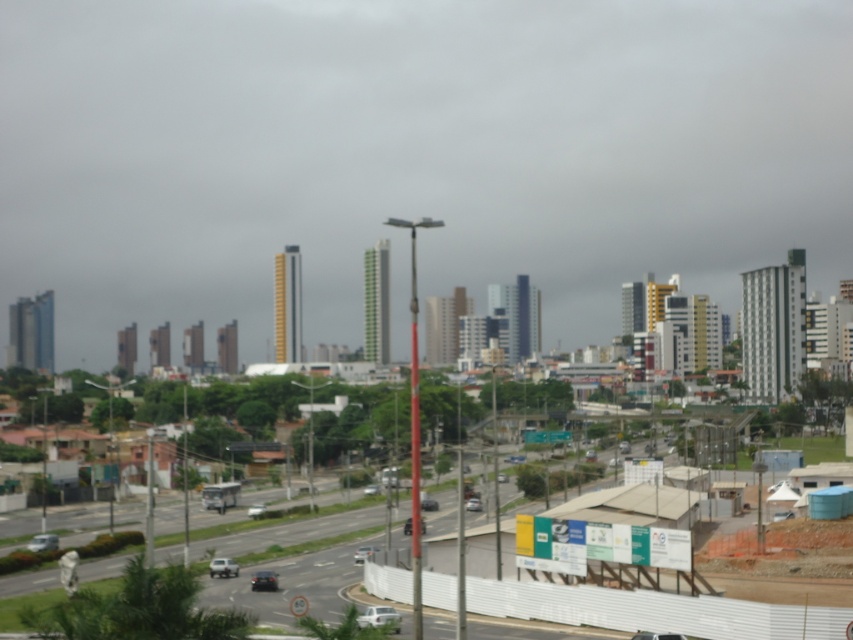
Does matte silver car at lower left appear on the right side of silver metallic car at center?

In fact, matte silver car at lower left is to the left of silver metallic car at center.

Can you confirm if matte silver car at lower left is bigger than silver metallic car at center?

No.

Image resolution: width=853 pixels, height=640 pixels. What do you see at coordinates (223, 566) in the screenshot?
I see `matte silver car at lower left` at bounding box center [223, 566].

Where is `matte silver car at lower left`? The height and width of the screenshot is (640, 853). matte silver car at lower left is located at coordinates (223, 566).

Between point (392, 632) and point (260, 509), which one is positioned behind?

Point (260, 509)

Is point (370, 609) less distant than point (264, 508)?

Yes, it is in front of point (264, 508).

Find the location of `white matte car at lower center`. white matte car at lower center is located at coordinates (380, 618).

Is shiny black car at center smaller than white matte car at center?

Indeed, shiny black car at center has a smaller size compared to white matte car at center.

Between point (265, 586) and point (252, 508), which one is positioned behind?

Point (252, 508)

Describe the element at coordinates (264, 580) in the screenshot. I see `shiny black car at center` at that location.

Locate an element on the screen. The height and width of the screenshot is (640, 853). shiny black car at center is located at coordinates (264, 580).